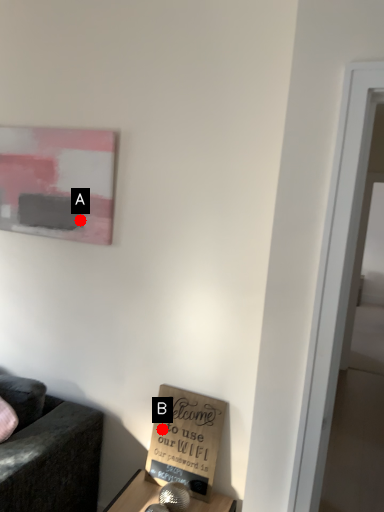
Question: Two points are circled on the image, labeled by A and B beside each circle. Which of the following is the closest to the observer?

Choices:
 (A) A is closer
 (B) B is closer

Answer: (B)